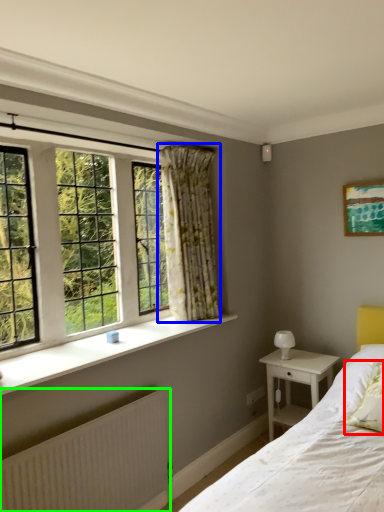
Question: Estimate the real-world distances between objects in this image. Which object is farther from pillow (highlighted by a red box), curtain (highlighted by a blue box) or radiator (highlighted by a green box)?

Choices:
 (A) curtain
 (B) radiator

Answer: (A)